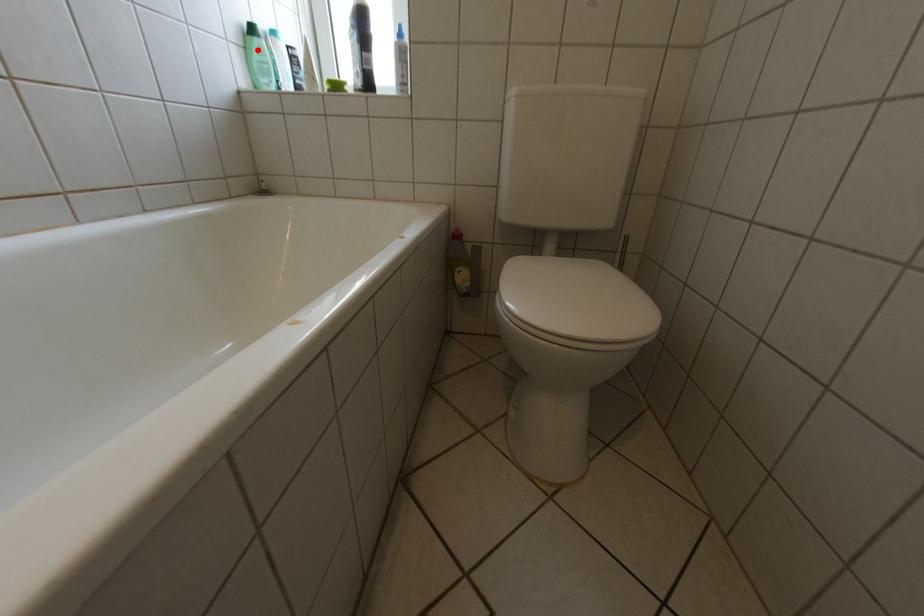
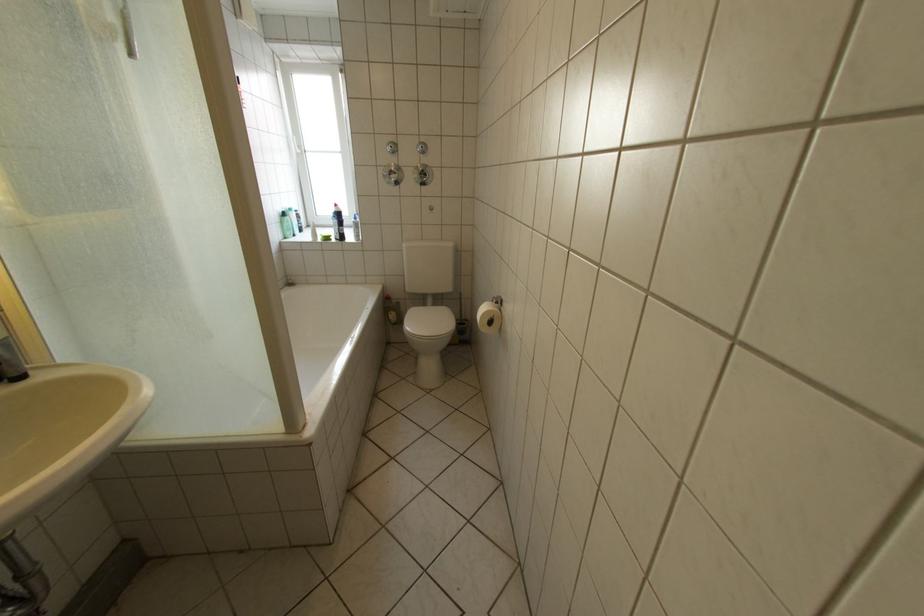
Question: I am providing you with two images of the same scene from different viewpoints. Given a red point in image1, look at the same physical point in image2. Is it:

Choices:
 (A) Closer to the viewpoint
 (B) Farther from the viewpoint

Answer: (A)